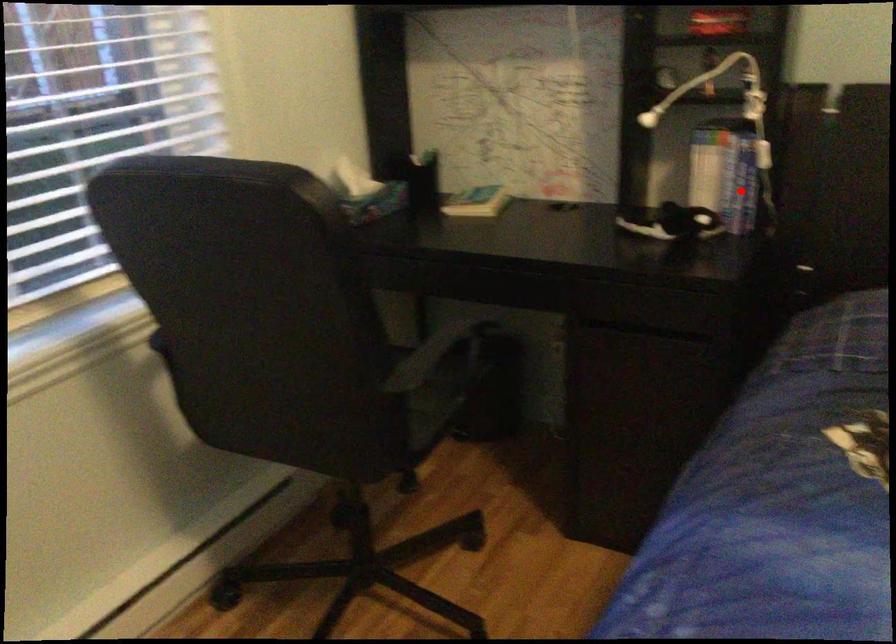
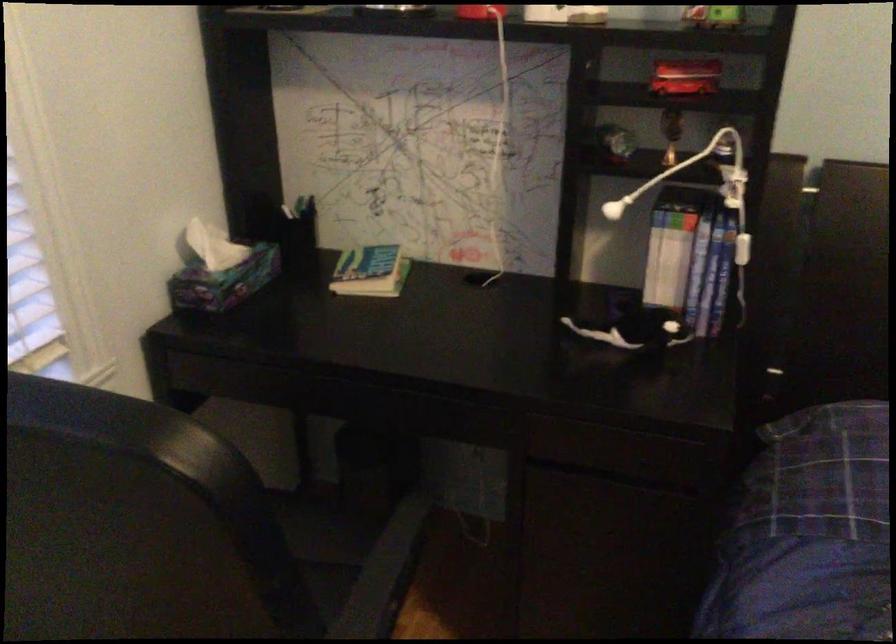
Question: I am providing you with two images of the same scene from different viewpoints. A red point is marked on the first image. At the location where the point appears in image 1, is it still visible in image 2?

Choices:
 (A) Yes
 (B) No

Answer: (A)